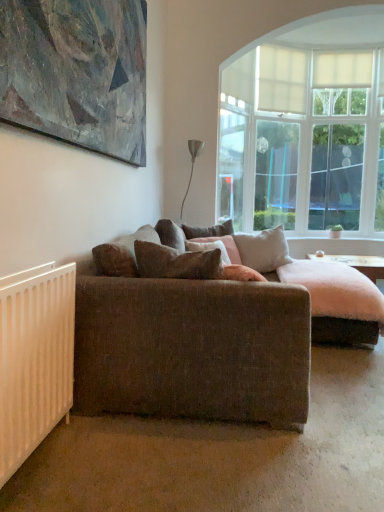
What do you see at coordinates (263, 249) in the screenshot? The height and width of the screenshot is (512, 384). I see `light beige fabric pillow at center, arranged as the 2th pillow when viewed from the back` at bounding box center [263, 249].

Identify the location of white sheer curtain at upper center. (282, 80).

What do you see at coordinates (34, 359) in the screenshot? The image size is (384, 512). I see `white matte radiator at lower left` at bounding box center [34, 359].

What is the approximate height of metallic silver lamp at upper center?

metallic silver lamp at upper center is 31.94 inches tall.

Locate an element on the screen. The height and width of the screenshot is (512, 384). metallic silver lamp at upper center is located at coordinates (192, 165).

What do you see at coordinates (336, 175) in the screenshot? This screenshot has height=512, width=384. I see `translucent glass door at upper right` at bounding box center [336, 175].

The width and height of the screenshot is (384, 512). In order to click on translucent glass door at upper right in this screenshot , I will do `click(336, 175)`.

Describe the element at coordinates (225, 246) in the screenshot. The image size is (384, 512). I see `brown fabric pillow at center, which is the third pillow in back-to-front order` at that location.

The height and width of the screenshot is (512, 384). Describe the element at coordinates (361, 264) in the screenshot. I see `felt-like pink coffee table at center` at that location.

Find the location of `light beige fabric pillow at center, which is the 3th pillow in front-to-back order`. light beige fabric pillow at center, which is the 3th pillow in front-to-back order is located at coordinates coord(263,249).

Between white sheer curtain at upper center and brown fabric pillow at center, marked as the 1th pillow in a back-to-front arrangement, which one has smaller size?

With smaller size is brown fabric pillow at center, marked as the 1th pillow in a back-to-front arrangement.

Which object is further away from the camera taking this photo, white sheer curtain at upper center or brown fabric pillow at center, the 4th pillow positioned from the front?

white sheer curtain at upper center.

Is white sheer curtain at upper center far from brown fabric pillow at center, marked as the 1th pillow in a back-to-front arrangement?

Yes, white sheer curtain at upper center and brown fabric pillow at center, marked as the 1th pillow in a back-to-front arrangement, are quite far apart.

Which of these two, translucent glass door at upper right or white sheer curtain at upper center, is thinner?

white sheer curtain at upper center.

Could you tell me if translucent glass door at upper right is facing white sheer curtain at upper center?

No, translucent glass door at upper right is not aimed at white sheer curtain at upper center.

Measure the distance from translucent glass door at upper right to white sheer curtain at upper center.

translucent glass door at upper right and white sheer curtain at upper center are 33.42 inches apart.

From a real-world perspective, relative to white sheer curtain at upper center, is translucent glass door at upper right vertically above or below?

translucent glass door at upper right is situated lower than white sheer curtain at upper center in the real world.

Is brown fabric pillow at center, marked as the 1th pillow in a back-to-front arrangement, looking in the opposite direction of light beige fabric pillow at center, arranged as the 2th pillow when viewed from the back?

brown fabric pillow at center, marked as the 1th pillow in a back-to-front arrangement, does not have its back to light beige fabric pillow at center, arranged as the 2th pillow when viewed from the back.

Looking at this image, which object is further away from the camera, brown fabric pillow at center, the 4th pillow positioned from the front, or light beige fabric pillow at center, which is the 3th pillow in front-to-back order?

brown fabric pillow at center, the 4th pillow positioned from the front.

From the image's perspective, is brown fabric pillow at center, marked as the 1th pillow in a back-to-front arrangement, beneath light beige fabric pillow at center, which is the 3th pillow in front-to-back order?

Actually, brown fabric pillow at center, marked as the 1th pillow in a back-to-front arrangement, appears above light beige fabric pillow at center, which is the 3th pillow in front-to-back order, in the image.

Considering the sizes of brown fabric pillow at center, marked as the 1th pillow in a back-to-front arrangement, and light beige fabric pillow at center, arranged as the 2th pillow when viewed from the back, in the image, is brown fabric pillow at center, marked as the 1th pillow in a back-to-front arrangement, wider or thinner than light beige fabric pillow at center, arranged as the 2th pillow when viewed from the back,?

brown fabric pillow at center, marked as the 1th pillow in a back-to-front arrangement, is thinner than light beige fabric pillow at center, arranged as the 2th pillow when viewed from the back.

Is white matte radiator at lower left facing away from light beige fabric pillow at center, arranged as the 2th pillow when viewed from the back?

white matte radiator at lower left is not turned away from light beige fabric pillow at center, arranged as the 2th pillow when viewed from the back.

Is white matte radiator at lower left further to the viewer compared to light beige fabric pillow at center, which is the 3th pillow in front-to-back order?

No.

Considering the sizes of white matte radiator at lower left and light beige fabric pillow at center, arranged as the 2th pillow when viewed from the back, in the image, is white matte radiator at lower left wider or thinner than light beige fabric pillow at center, arranged as the 2th pillow when viewed from the back,?

Clearly, white matte radiator at lower left has less width compared to light beige fabric pillow at center, arranged as the 2th pillow when viewed from the back.

Considering the points (2, 356) and (259, 234), which point is in front, point (2, 356) or point (259, 234)?

Point (2, 356)

Which object is closer to the camera, felt-like pink coffee table at center or painted canvas at upper left?

Positioned in front is painted canvas at upper left.

Based on their positions, is felt-like pink coffee table at center located to the left or right of painted canvas at upper left?

felt-like pink coffee table at center is positioned on painted canvas at upper left's right side.

From the image's perspective, is felt-like pink coffee table at center on painted canvas at upper left?

No, from the image's perspective, felt-like pink coffee table at center is not above painted canvas at upper left.

Which object is further away from the camera, textured brown couch at center or brown fabric pillow at center, which is the 1th pillow from front to back?

brown fabric pillow at center, which is the 1th pillow from front to back.

Based on their positions, is textured brown couch at center located to the left or right of brown fabric pillow at center, which is the 1th pillow from front to back?

From the image, it's evident that textured brown couch at center is to the right of brown fabric pillow at center, which is the 1th pillow from front to back.

From the image's perspective, which object appears higher, textured brown couch at center or brown fabric pillow at center, which is the 1th pillow from front to back?

brown fabric pillow at center, which is the 1th pillow from front to back, appears higher in the image.

Would you say textured brown couch at center is a long distance from brown fabric pillow at center, which is the 1th pillow from front to back?

Actually, textured brown couch at center and brown fabric pillow at center, which is the 1th pillow from front to back, are a little close together.

From the image's perspective, count 3rd pillows downward from the brown fabric pillow at center, marked as the 1th pillow in a back-to-front arrangement, and point to it. Please provide its 2D coordinates.

[(176, 262)]

Is brown fabric pillow at center, which ranks as the 4th pillow in back-to-front order, oriented away from brown fabric pillow at center, the 4th pillow positioned from the front?

No, brown fabric pillow at center, the 4th pillow positioned from the front, is not at the back of brown fabric pillow at center, which ranks as the 4th pillow in back-to-front order.

Is brown fabric pillow at center, which ranks as the 4th pillow in back-to-front order, far from brown fabric pillow at center, the 4th pillow positioned from the front?

brown fabric pillow at center, which ranks as the 4th pillow in back-to-front order, is far away from brown fabric pillow at center, the 4th pillow positioned from the front.

Between brown fabric pillow at center, which ranks as the 4th pillow in back-to-front order, and brown fabric pillow at center, the 4th pillow positioned from the front, which one has more height?

Standing taller between the two is brown fabric pillow at center, the 4th pillow positioned from the front.

This screenshot has height=512, width=384. What are the coordinates of `curtain above the brown fabric pillow at center, the 4th pillow positioned from the front (from a real-world perspective)` in the screenshot? It's located at (282, 80).

Locate an element on the screen. curtain lying in front of the translucent glass door at upper right is located at coordinates click(x=282, y=80).

Based on their spatial positions, is metallic silver lamp at upper center or white matte radiator at lower left closer to brown fabric pillow at center, which is the 1th pillow from front to back?

white matte radiator at lower left lies closer to brown fabric pillow at center, which is the 1th pillow from front to back, than the other object.

Considering their positions, is painted canvas at upper left positioned further to white matte radiator at lower left than felt-like pink coffee table at center?

felt-like pink coffee table at center lies further to white matte radiator at lower left than the other object.

Looking at this image, estimate the real-world distances between objects in this image. Which object is closer to textured brown couch at center, translucent glass door at upper right or metallic silver lamp at upper center?

Among the two, metallic silver lamp at upper center is located nearer to textured brown couch at center.

Estimate the real-world distances between objects in this image. Which object is further from white matte radiator at lower left, brown fabric pillow at center, which ranks as the 4th pillow in back-to-front order, or translucent glass door at upper right?

translucent glass door at upper right is positioned further to the anchor white matte radiator at lower left.

Considering their positions, is textured brown couch at center positioned closer to light beige fabric pillow at center, arranged as the 2th pillow when viewed from the back, than white matte radiator at lower left?

textured brown couch at center.

From the image, which object appears to be farther from white matte radiator at lower left, metallic silver lamp at upper center or light beige fabric pillow at center, arranged as the 2th pillow when viewed from the back?

metallic silver lamp at upper center lies further to white matte radiator at lower left than the other object.

Considering their positions, is white sheer curtain at upper center positioned further to textured brown couch at center than brown fabric pillow at center, marked as the 1th pillow in a back-to-front arrangement?

Based on the image, white sheer curtain at upper center appears to be further to textured brown couch at center.

Based on their spatial positions, is light beige fabric pillow at center, which is the 3th pillow in front-to-back order, or white sheer curtain at upper center further from felt-like pink coffee table at center?

white sheer curtain at upper center lies further to felt-like pink coffee table at center than the other object.

Find the location of a particular element. studio couch positioned between white matte radiator at lower left and translucent glass door at upper right from near to far is located at coordinates (207, 336).

Locate an element on the screen. This screenshot has height=512, width=384. coffee table located between textured brown couch at center and white sheer curtain at upper center in the depth direction is located at coordinates (361, 264).

I want to click on studio couch located between painted canvas at upper left and brown fabric pillow at center, arranged as the 2th pillow when viewed from the front, in the depth direction, so click(207, 336).

You are a GUI agent. You are given a task and a screenshot of the screen. Output one action in this format:
    pyautogui.click(x=<x>, y=<y>)
    Task: Click on the studio couch between white matte radiator at lower left and brown fabric pillow at center, which ranks as the 4th pillow in back-to-front order, in the front-back direction
    This screenshot has width=384, height=512.
    Given the screenshot: What is the action you would take?
    pyautogui.click(x=207, y=336)